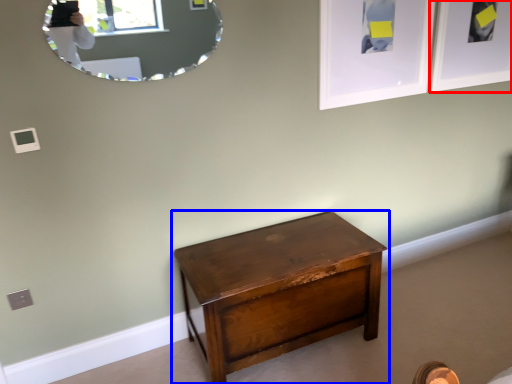
Question: Among these objects, which one is farthest to the camera, picture frame (highlighted by a red box) or nightstand (highlighted by a blue box)?

Choices:
 (A) picture frame
 (B) nightstand

Answer: (A)